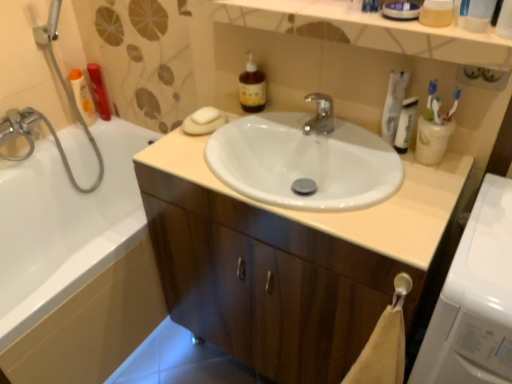
Question: From a real-world perspective, is white plastic toothbrush at upper right, the 2th toothbrush in the left-to-right sequence, located beneath white matte soap at upper center?

Choices:
 (A) no
 (B) yes

Answer: (A)

Question: Is white plastic toothbrush at upper right, the 2th toothbrush in the left-to-right sequence, positioned in front of white matte soap at upper center?

Choices:
 (A) no
 (B) yes

Answer: (B)

Question: Can you confirm if white plastic toothbrush at upper right, the 2th toothbrush in the left-to-right sequence, is taller than white matte soap at upper center?

Choices:
 (A) no
 (B) yes

Answer: (B)

Question: From the image's perspective, is white plastic toothbrush at upper right, acting as the first toothbrush starting from the right, on top of white matte soap at upper center?

Choices:
 (A) no
 (B) yes

Answer: (A)

Question: Is white plastic toothbrush at upper right, the 2th toothbrush in the left-to-right sequence, outside of white matte soap at upper center?

Choices:
 (A) no
 (B) yes

Answer: (B)

Question: Visually, is translucent plastic mouthwash at upper left, which ranks as the second mouthwash in left-to-right order, positioned to the left or to the right of white plastic cup at upper right?

Choices:
 (A) left
 (B) right

Answer: (A)

Question: Is point pos(98,84) closer or farther from the camera than point pos(437,132)?

Choices:
 (A) farther
 (B) closer

Answer: (A)

Question: From a real-world perspective, is translucent plastic mouthwash at upper left, marked as the 2th mouthwash in a right-to-left arrangement, physically located above or below white plastic cup at upper right?

Choices:
 (A) below
 (B) above

Answer: (A)

Question: In the image, is translucent plastic mouthwash at upper left, which ranks as the third mouthwash in front-to-back order, positioned in front of or behind white plastic cup at upper right?

Choices:
 (A) front
 (B) behind

Answer: (B)

Question: Looking at their shapes, would you say white glossy tube at upper right is wider or thinner than white glossy bathtub at left?

Choices:
 (A) wide
 (B) thin

Answer: (B)

Question: Relative to white glossy bathtub at left, is white glossy tube at upper right in front or behind?

Choices:
 (A) behind
 (B) front

Answer: (A)

Question: From their relative heights in the image, would you say white glossy tube at upper right is taller or shorter than white glossy bathtub at left?

Choices:
 (A) short
 (B) tall

Answer: (A)

Question: Considering the positions of white glossy tube at upper right and white glossy bathtub at left in the image, is white glossy tube at upper right bigger or smaller than white glossy bathtub at left?

Choices:
 (A) big
 (B) small

Answer: (B)

Question: Is white plastic tube at upper right, placed as the first mouthwash when sorted from front to back, inside the boundaries of translucent plastic bottle at upper left, marked as the 1th mouthwash in a left-to-right arrangement, or outside?

Choices:
 (A) outside
 (B) inside

Answer: (A)

Question: In terms of width, does white plastic tube at upper right, which appears as the 1th mouthwash when viewed from the right, look wider or thinner when compared to translucent plastic bottle at upper left, the third mouthwash viewed from the right?

Choices:
 (A) thin
 (B) wide

Answer: (A)